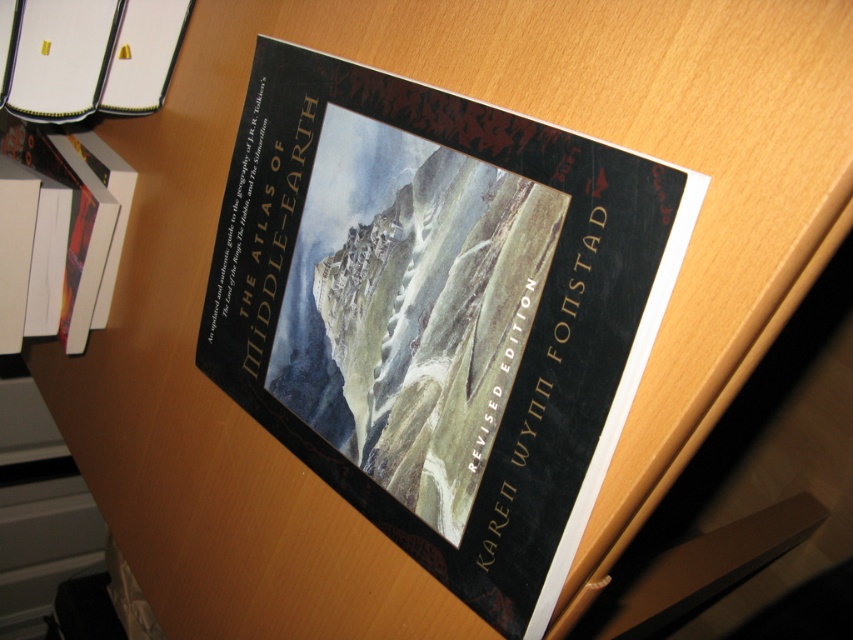
Question: Observing the image, what is the correct spatial positioning of hardcover book at upper left in reference to white paper at left?

Choices:
 (A) left
 (B) right

Answer: (B)

Question: Can you confirm if hardcover book at center is positioned above hardcover book at upper left?

Choices:
 (A) yes
 (B) no

Answer: (B)

Question: Considering the real-world distances, which object is farthest from the hardcover book at upper left?

Choices:
 (A) hardcover book at center
 (B) white paper at left

Answer: (A)

Question: Does hardcover book at center have a lesser width compared to white paper at left?

Choices:
 (A) yes
 (B) no

Answer: (B)

Question: Which object appears closest to the camera in this image?

Choices:
 (A) hardcover book at upper left
 (B) hardcover book at center
 (C) white paper at left

Answer: (B)

Question: Which object appears closest to the camera in this image?

Choices:
 (A) hardcover book at center
 (B) white paper at left

Answer: (A)